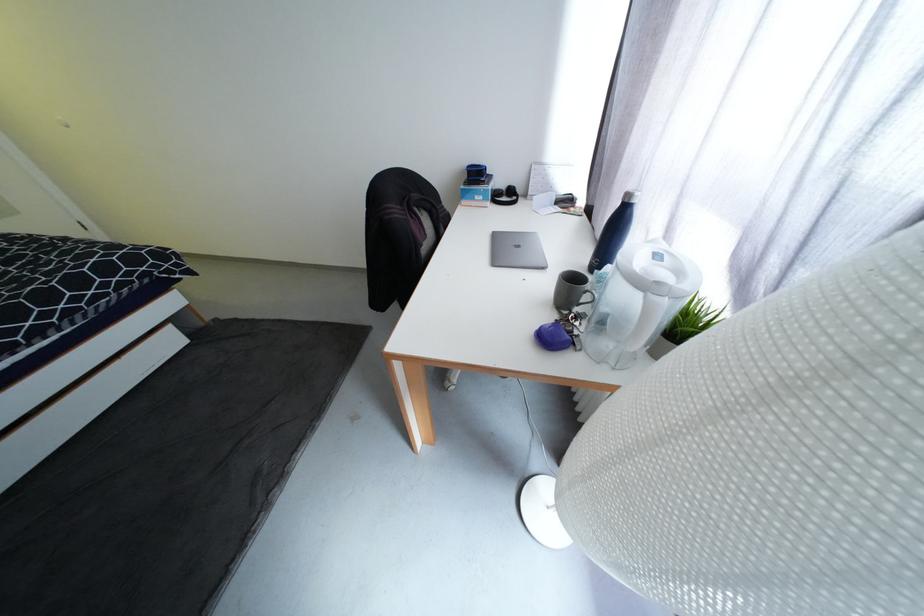
Find the location of a particular element. This screenshot has width=924, height=616. blue bottle cap is located at coordinates (553, 336).